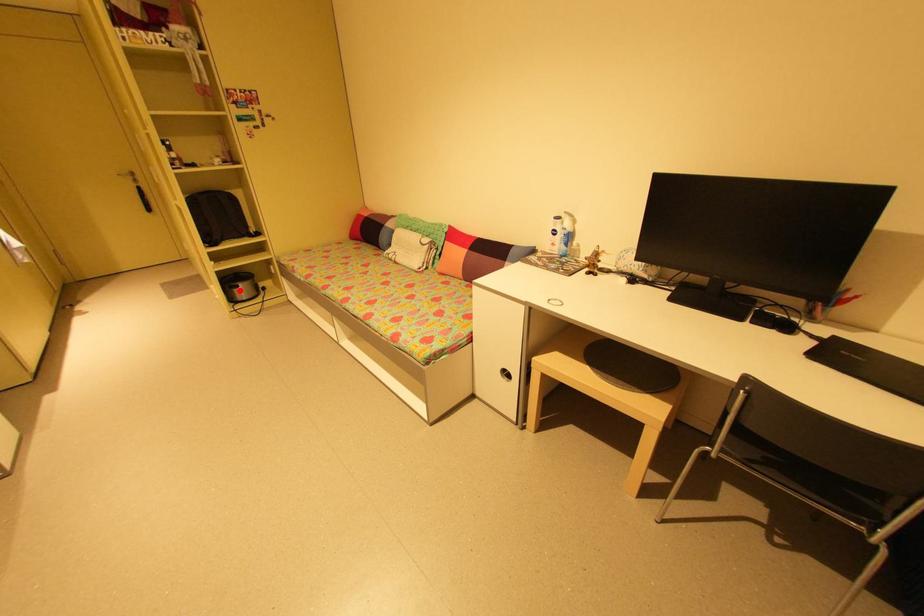
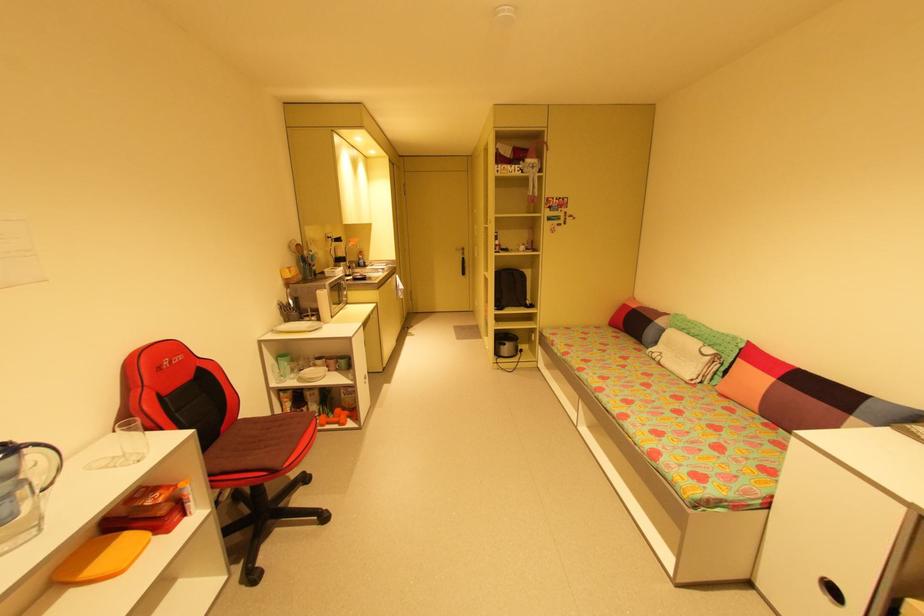
Where in the second image is the point corresponding to the highlighted location from the first image?

(505, 347)